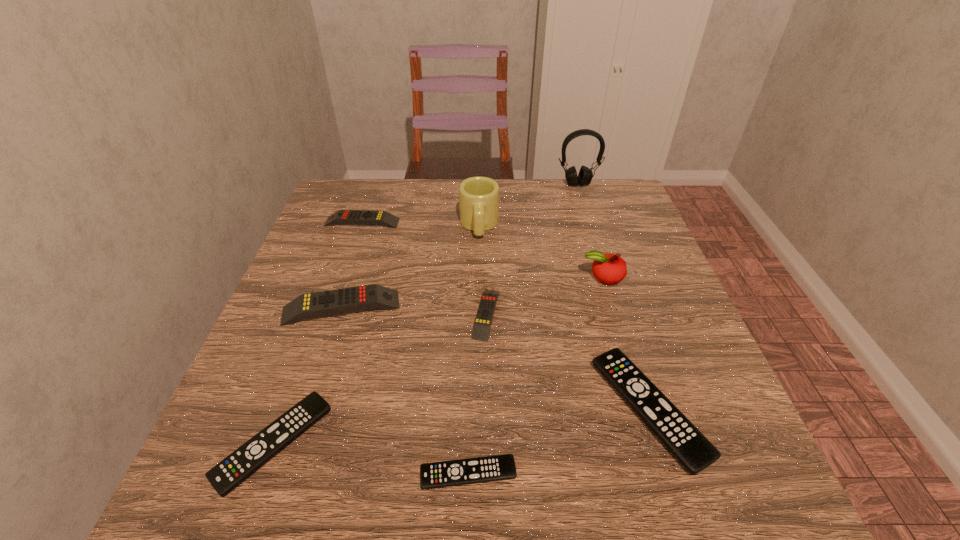
Locate an element on the screen. This screenshot has height=540, width=960. remote control at the right edge is located at coordinates (690, 447).

Image resolution: width=960 pixels, height=540 pixels. I want to click on object that is positioned at the far left corner, so click(x=357, y=217).

You are a GUI agent. You are given a task and a screenshot of the screen. Output one action in this format:
    pyautogui.click(x=<x>, y=<y>)
    Task: Click on the object that is at the near left corner
    This screenshot has height=540, width=960.
    Given the screenshot: What is the action you would take?
    pyautogui.click(x=225, y=476)

Identify the location of object located in the far right corner section of the desktop. The image size is (960, 540). point(585,175).

The image size is (960, 540). What are the coordinates of `object located at the near right corner` in the screenshot? It's located at (690, 447).

Locate an element on the screen. free space at the far edge of the desktop is located at coordinates (519, 201).

The width and height of the screenshot is (960, 540). Find the location of `vacant position at the left edge of the desktop`. vacant position at the left edge of the desktop is located at coordinates click(311, 338).

In the image, there is a desktop. Find the location of `vacant space at the right edge`. vacant space at the right edge is located at coordinates (611, 237).

In the image, there is a desktop. Identify the location of free space at the far left corner. (391, 180).

The height and width of the screenshot is (540, 960). What are the coordinates of `vacant space at the far right corner of the desktop` in the screenshot? It's located at (614, 205).